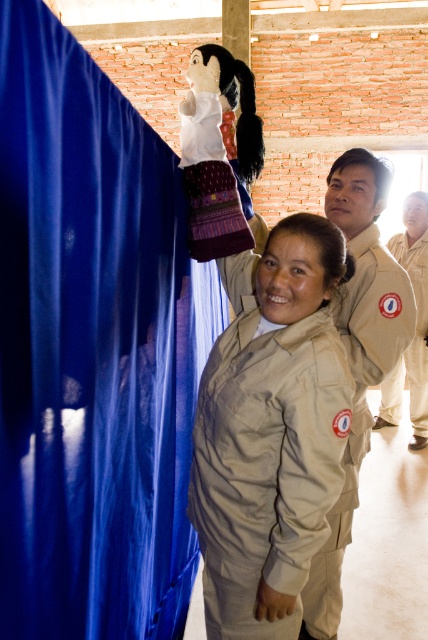
Looking at this image, can you confirm if blue fabric curtain at left is shorter than beige uniform at center?

Yes.

Between blue fabric curtain at left and beige uniform at center, which one is positioned higher?

beige uniform at center is above.

Is point (137, 458) behind point (395, 378)?

No, (137, 458) is in front of (395, 378).

Image resolution: width=428 pixels, height=640 pixels. I want to click on blue fabric curtain at left, so click(x=92, y=349).